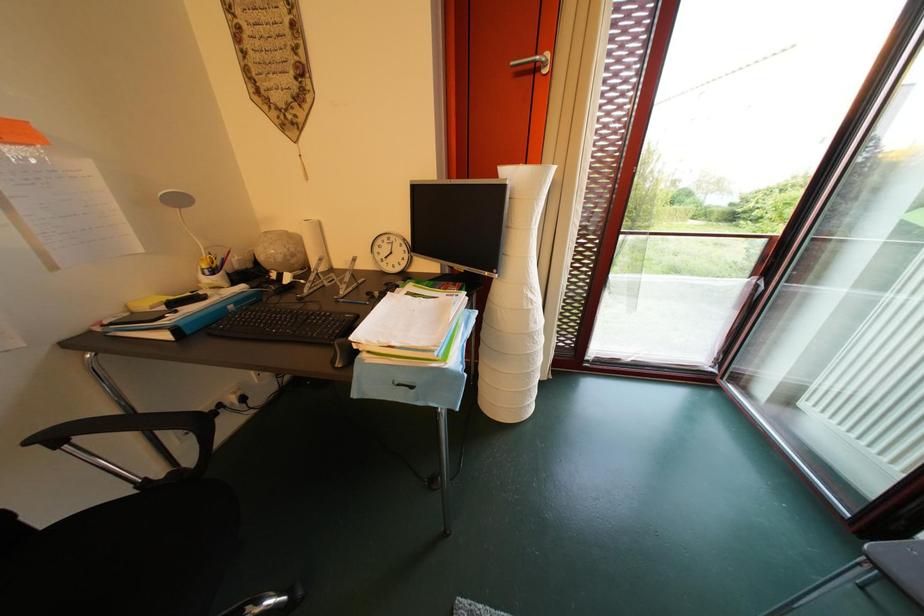
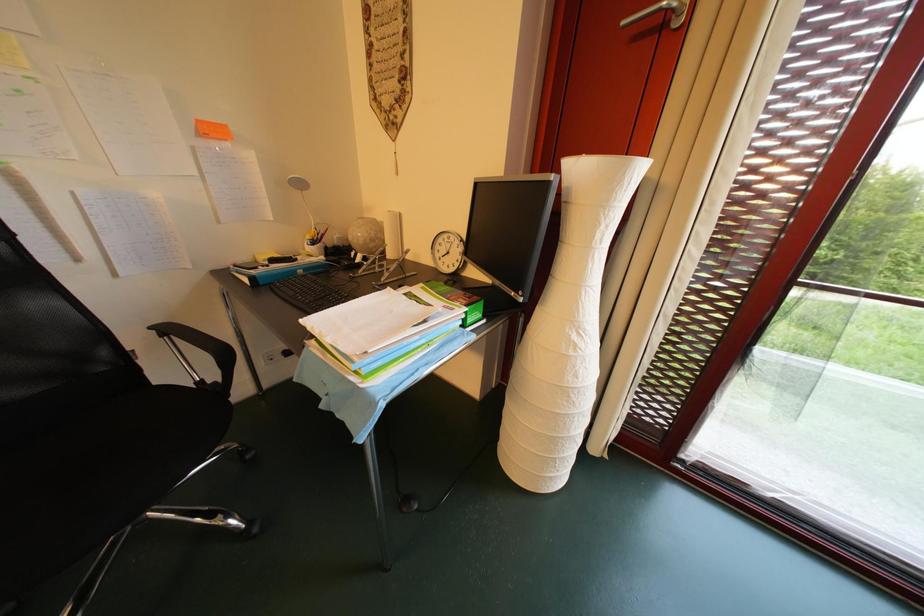
Question: The images are taken continuously from a first-person perspective. In which direction is your viewpoint rotating?

Choices:
 (A) Left
 (B) Right
 (C) Up
 (D) Down

Answer: (A)